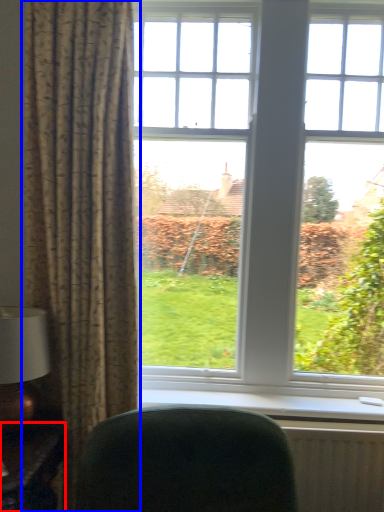
Question: Which point is closer to the camera, table (highlighted by a red box) or curtain (highlighted by a blue box)?

Choices:
 (A) table
 (B) curtain

Answer: (A)